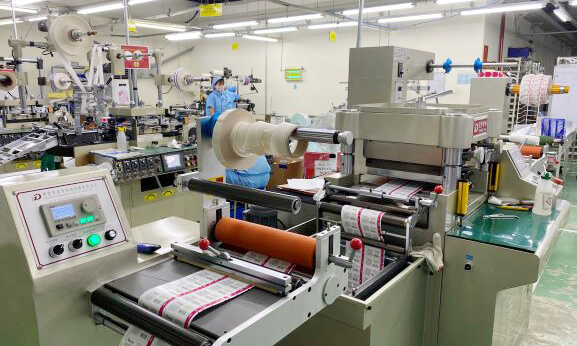
I want to click on lcd screen, so click(x=65, y=211), click(x=170, y=165).